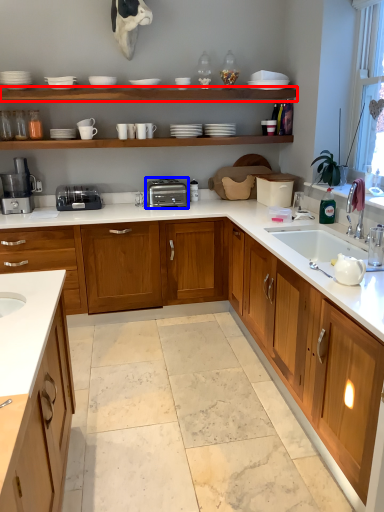
Question: Among these objects, which one is farthest to the camera, shelf (highlighted by a red box) or toaster (highlighted by a blue box)?

Choices:
 (A) shelf
 (B) toaster

Answer: (B)